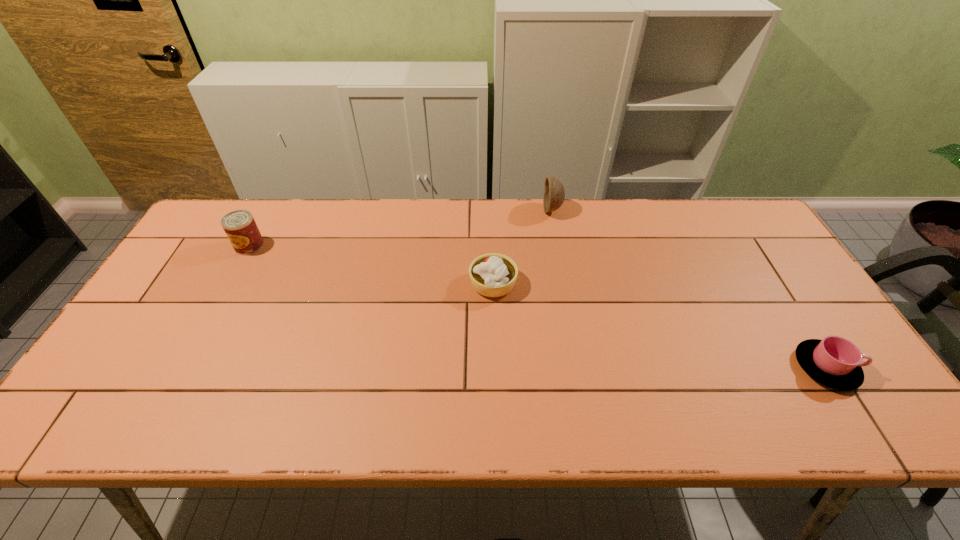
This screenshot has width=960, height=540. In the image, there is a desktop. What are the coordinates of `vacant space at the far right corner` in the screenshot? It's located at (734, 240).

What are the coordinates of `vacant space at the near right corner of the desktop` in the screenshot? It's located at (854, 429).

Locate an element on the screen. This screenshot has height=540, width=960. free space between the shortest object and the bowl is located at coordinates (688, 289).

Find the location of a particular element. This screenshot has width=960, height=540. unoccupied position between the third object from left to right and the leftmost object is located at coordinates (401, 228).

This screenshot has height=540, width=960. I want to click on free space between the farthest object and the third object from right to left, so click(x=523, y=247).

Where is `unoccupied area between the nearest object and the third object from left to right`? Image resolution: width=960 pixels, height=540 pixels. unoccupied area between the nearest object and the third object from left to right is located at coordinates (688, 289).

Find the location of a particular element. The width and height of the screenshot is (960, 540). free space between the third object from left to right and the second object from left to right is located at coordinates (523, 247).

In order to click on free space between the nearest object and the second object from left to right in this screenshot , I will do `click(660, 326)`.

The width and height of the screenshot is (960, 540). Find the location of `free space between the shortest object and the bowl`. free space between the shortest object and the bowl is located at coordinates (688, 289).

In order to click on empty space that is in between the cup and the farthest object in this screenshot , I will do `click(688, 289)`.